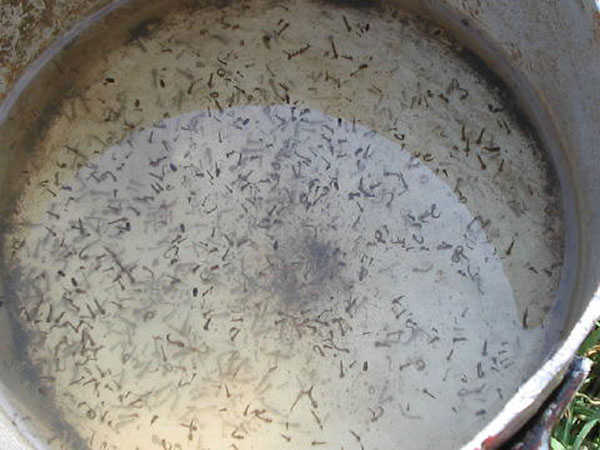
I want to click on bottom of pan, so click(x=427, y=296).